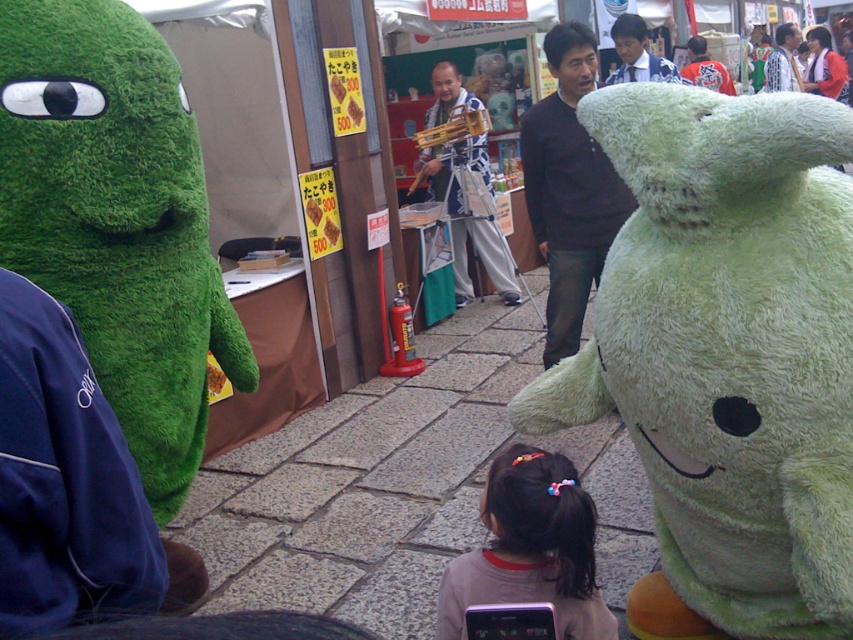
Question: Is green plush toy at center positioned before dark blue sweater at center?

Choices:
 (A) no
 (B) yes

Answer: (B)

Question: Which point appears farthest from the camera in this image?

Choices:
 (A) (550, 116)
 (B) (817, 74)

Answer: (B)

Question: Does green plush toy at center have a lesser width compared to white shirt at upper right?

Choices:
 (A) no
 (B) yes

Answer: (B)

Question: Which point is closer to the camera?

Choices:
 (A) blue and white striped apron at center
 (B) green plush toy at center
 (C) orange jersey at upper right

Answer: (B)

Question: Is blue and white striped apron at center wider than orange jersey at upper right?

Choices:
 (A) yes
 (B) no

Answer: (A)

Question: Among these points, which one is nearest to the camera?

Choices:
 (A) (688, 67)
 (B) (584, 252)
 (C) (825, 29)
 (D) (460, 144)

Answer: (B)